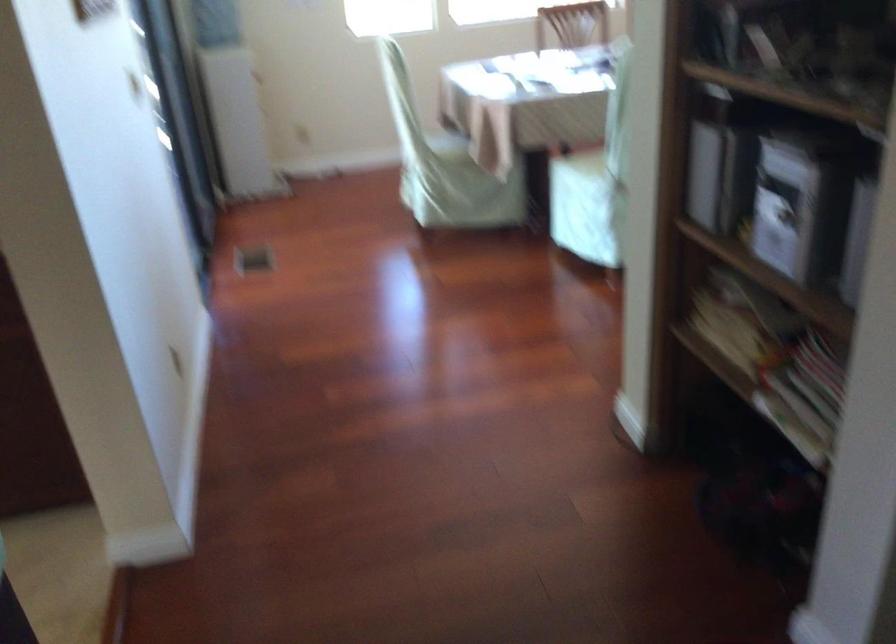
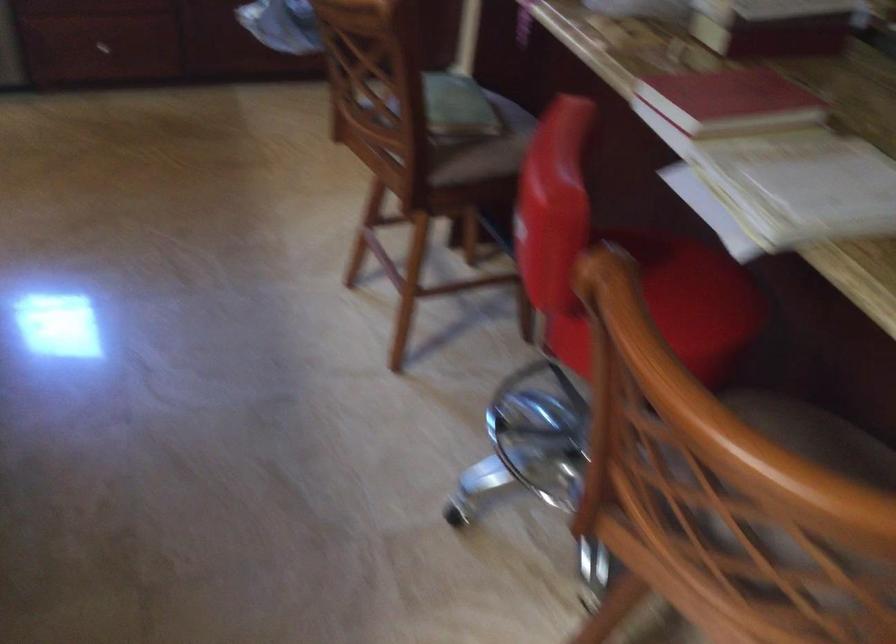
Looking at this image, the images are taken continuously from a first-person perspective. In which direction are you moving?

The cameraman walked toward left, backward.